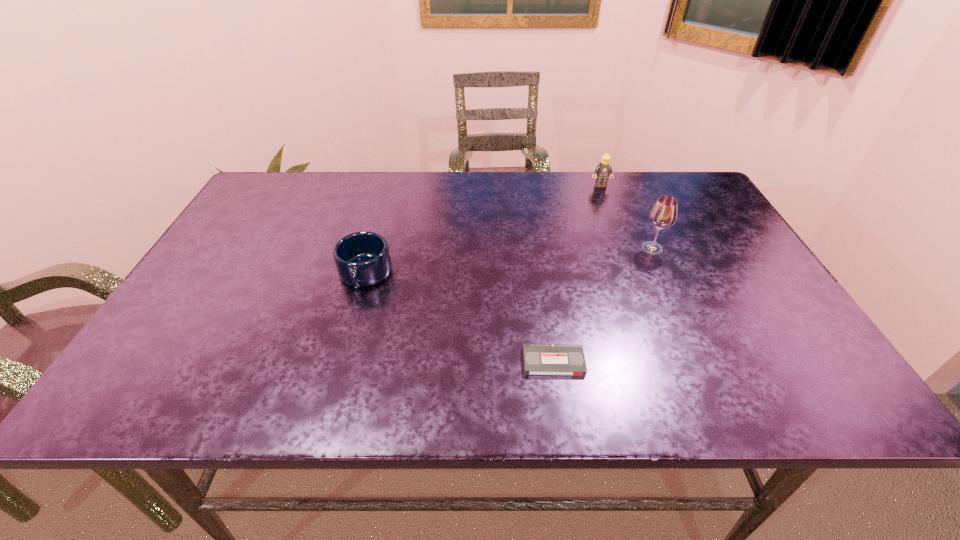
You are a GUI agent. You are given a task and a screenshot of the screen. Output one action in this format:
    pyautogui.click(x=<x>, y=<y>)
    Task: Click on the rightmost object
    
    Given the screenshot: What is the action you would take?
    pyautogui.click(x=663, y=214)

Image resolution: width=960 pixels, height=540 pixels. I want to click on wineglass, so click(663, 214).

Where is `the farthest object`? the farthest object is located at coordinates (603, 170).

In order to click on the second object from right to left in this screenshot , I will do `click(603, 170)`.

Identify the location of the leftmost object. The height and width of the screenshot is (540, 960). (362, 259).

You are a GUI agent. You are given a task and a screenshot of the screen. Output one action in this format:
    pyautogui.click(x=<x>, y=<y>)
    Task: Click on the mug
    The height and width of the screenshot is (540, 960).
    Given the screenshot: What is the action you would take?
    pyautogui.click(x=362, y=259)

This screenshot has width=960, height=540. Identify the location of the shortest object. (539, 359).

Identify the location of videotape. The height and width of the screenshot is (540, 960). (539, 359).

Identify the location of vacant space situated on the right of the rightmost object. This screenshot has width=960, height=540. (688, 248).

I want to click on free space located 0.280m in front of the Lego, so click(x=623, y=246).